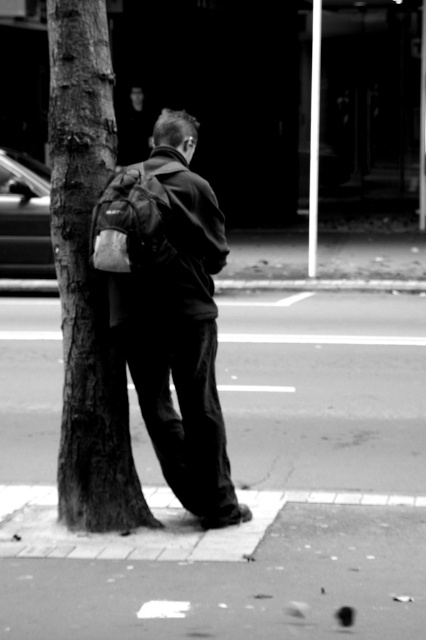
The image size is (426, 640). What are the coordinates of `matte black backpack at left` in the screenshot? It's located at (170, 314).

Is point (106, 269) farther from viewer compared to point (98, 285)?

No.

Image resolution: width=426 pixels, height=640 pixels. Identify the location of matte black backpack at left. (170, 314).

You are a GUI agent. You are given a task and a screenshot of the screen. Output one action in this format:
    pyautogui.click(x=<x>, y=<y>)
    Task: Click on the matte black backpack at left
    
    Given the screenshot: What is the action you would take?
    (x=170, y=314)

Who is positioned more to the left, smooth concrete pavement at center or matte black backpack at left?

Positioned to the left is smooth concrete pavement at center.

Can you confirm if smooth concrete pavement at center is wider than matte black backpack at left?

Yes.

Between point (264, 380) and point (120, 188), which one is positioned in front?

Point (120, 188)

This screenshot has width=426, height=640. In order to click on smooth concrete pavement at center in this screenshot , I will do `click(325, 390)`.

Who is positioned more to the left, smooth concrete pavement at center or smooth bark tree at center?

smooth bark tree at center is more to the left.

Can you confirm if smooth concrete pavement at center is positioned to the left of smooth bark tree at center?

In fact, smooth concrete pavement at center is to the right of smooth bark tree at center.

Who is more forward, (232,337) or (77,509)?

Point (77,509) is more forward.

Where is `smooth concrete pavement at center`? The image size is (426, 640). smooth concrete pavement at center is located at coordinates (325, 390).